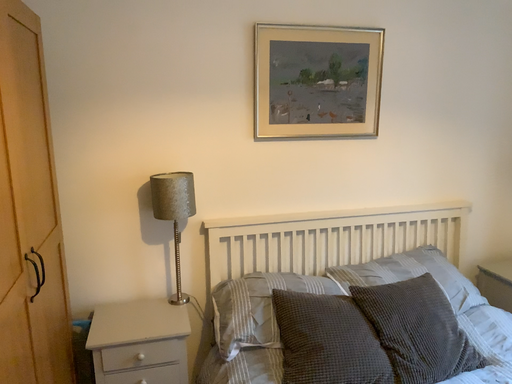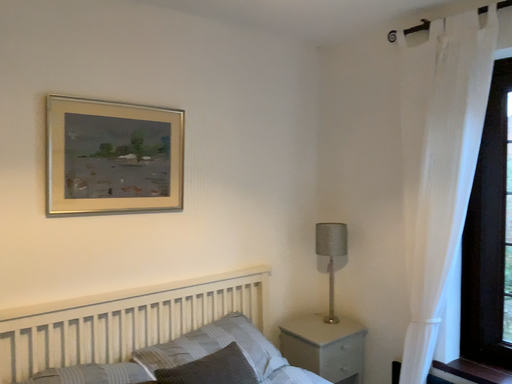
Question: How did the camera likely rotate when shooting the video?

Choices:
 (A) rotated right
 (B) rotated left

Answer: (A)